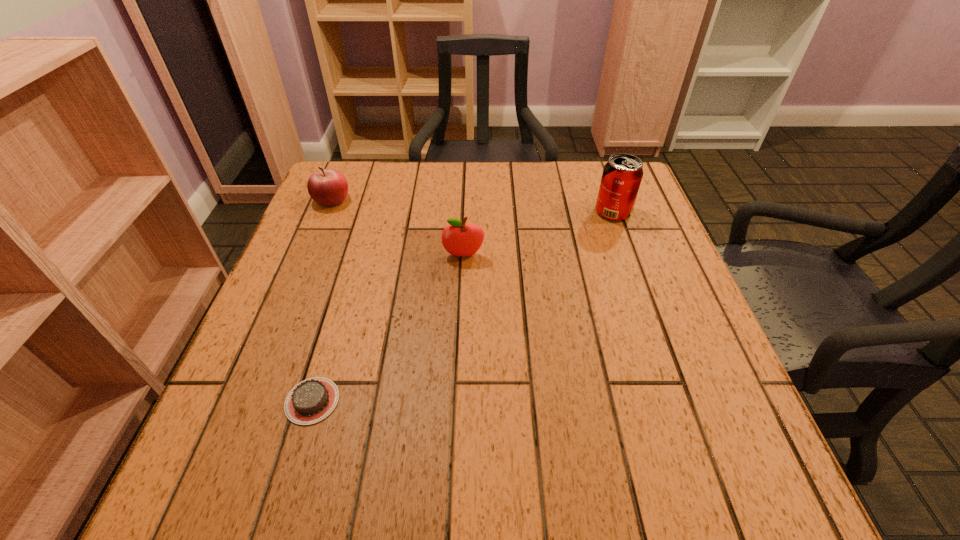
The width and height of the screenshot is (960, 540). Find the location of `vacant area that lies between the rightmost object and the third farthest object`. vacant area that lies between the rightmost object and the third farthest object is located at coordinates (539, 234).

You are a GUI agent. You are given a task and a screenshot of the screen. Output one action in this format:
    pyautogui.click(x=<x>, y=<y>)
    Task: Click on the free space between the nearest object and the second object from right to left
    
    Given the screenshot: What is the action you would take?
    pyautogui.click(x=388, y=328)

Identify the location of blank region between the rightmost object and the shorter apple. (472, 206).

Identify the location of free area in between the shorter apple and the tallest object. Image resolution: width=960 pixels, height=540 pixels. (472, 206).

The width and height of the screenshot is (960, 540). Find the location of `empty space between the third object from left to right and the soda can`. empty space between the third object from left to right and the soda can is located at coordinates (539, 234).

Locate an element on the screen. object that is the second closest to the tallest object is located at coordinates (328, 187).

I want to click on object that can be found as the closest to the right apple, so click(328, 187).

Locate an element on the screen. This screenshot has height=540, width=960. free space that satisfies the following two spatial constraints: 1. on the back side of the third object from right to left; 2. on the left side of the right apple is located at coordinates (355, 255).